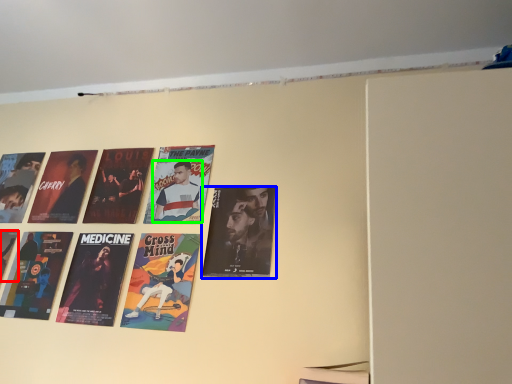
Question: Which object is positioned closest to poster (highlighted by a red box)? Select from poster (highlighted by a blue box) and person (highlighted by a green box).

Choices:
 (A) poster
 (B) person

Answer: (B)